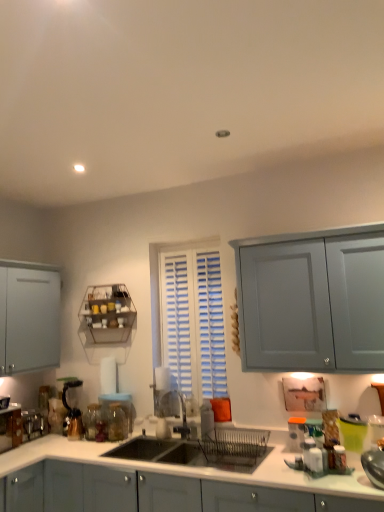
The image size is (384, 512). Describe the element at coordinates (34, 424) in the screenshot. I see `metallic silver toaster at lower left, the third appliance positioned from the front` at that location.

The image size is (384, 512). Describe the element at coordinates (117, 422) in the screenshot. I see `transparent glass jar at sink, the 1th glass jar viewed from the right` at that location.

This screenshot has width=384, height=512. What do you see at coordinates (106, 321) in the screenshot? I see `metallic wire rack at upper left` at bounding box center [106, 321].

Measure the distance between metallic wire rack at upper left and camera.

They are 3.28 meters apart.

The image size is (384, 512). Describe the element at coordinates (94, 423) in the screenshot. I see `transparent glass jar at lower left, the second glass jar viewed from the right` at that location.

Find the location of `white glossy salt shaker at lower right, the 2th appliance in the left-to-right sequence`. white glossy salt shaker at lower right, the 2th appliance in the left-to-right sequence is located at coordinates (314, 458).

At what (x,y) coordinates should I click in order to perform the action: click on metallic silver toaster at lower left, which appears as the 1th appliance when viewed from the back. Please return your answer as a coordinate pair (x, y). The height and width of the screenshot is (512, 384). Looking at the image, I should click on [x=34, y=424].

In the scene shown: From a real-world perspective, relative to metallic silver toaster at lower left, which is the 1th appliance in left-to-right order, is metallic wire rack at upper left vertically above or below?

Clearly, from a real-world perspective, metallic wire rack at upper left is above metallic silver toaster at lower left, which is the 1th appliance in left-to-right order.

Between point (127, 289) and point (30, 423), which one is positioned in front?

The point (30, 423) is more forward.

Is metallic wire rack at upper left in front of metallic silver toaster at lower left, which is the 3th appliance in right-to-left order?

No, it is not.

Is metallic wire rack at upper left inside or outside of metallic silver toaster at lower left, which is the 1th appliance in left-to-right order?

metallic wire rack at upper left is outside metallic silver toaster at lower left, which is the 1th appliance in left-to-right order.

From the image's perspective, is white glossy salt shaker at lower right, the 3th appliance when ordered from back to front, above metallic silver toaster at lower left, which appears as the 1th appliance when viewed from the back?

Indeed, from the image's perspective, white glossy salt shaker at lower right, the 3th appliance when ordered from back to front, is shown above metallic silver toaster at lower left, which appears as the 1th appliance when viewed from the back.

Does white glossy salt shaker at lower right, the 3th appliance when ordered from back to front, lie behind metallic silver toaster at lower left, which appears as the 1th appliance when viewed from the back?

No, it is in front of metallic silver toaster at lower left, which appears as the 1th appliance when viewed from the back.

How distant is white glossy salt shaker at lower right, the second appliance from the right, from metallic silver toaster at lower left, which appears as the 1th appliance when viewed from the back?

white glossy salt shaker at lower right, the second appliance from the right, and metallic silver toaster at lower left, which appears as the 1th appliance when viewed from the back, are 2.02 meters apart.

In the scene shown: Is white glossy salt shaker at lower right, the first appliance viewed from the front, positioned beyond the bounds of metallic silver toaster at lower left, which is the 1th appliance in left-to-right order?

Yes, white glossy salt shaker at lower right, the first appliance viewed from the front, is not within metallic silver toaster at lower left, which is the 1th appliance in left-to-right order.

Looking at this image, from the image's perspective, between white glossy salt shaker at lower right, the 3th appliance when ordered from back to front, and matte plastic container at right, the 2th appliance when ordered from front to back, who is located below?

From the image's view, matte plastic container at right, the 2th appliance when ordered from front to back, is below.

Is white glossy salt shaker at lower right, the second appliance from the right, aimed at matte plastic container at right, the 3th appliance positioned from the left?

No.

Is white glossy salt shaker at lower right, the first appliance viewed from the front, positioned far away from matte plastic container at right, the 2th appliance when ordered from front to back?

That's not correct — white glossy salt shaker at lower right, the first appliance viewed from the front, is a little close to matte plastic container at right, the 2th appliance when ordered from front to back.

Looking at this image, how far apart are white glossy salt shaker at lower right, the first appliance viewed from the front, and matte plastic container at right, which is the 2th appliance from back to front?

white glossy salt shaker at lower right, the first appliance viewed from the front, is 7.59 inches from matte plastic container at right, which is the 2th appliance from back to front.

From a real-world perspective, between transparent glass jar at lower left, the second glass jar viewed from the right, and metallic wire rack at upper left, who is vertically higher?

From a 3D spatial view, metallic wire rack at upper left is above.

From the image's perspective, is transparent glass jar at lower left, which appears as the first glass jar when viewed from the left, below metallic wire rack at upper left?

Yes, from the image's perspective, transparent glass jar at lower left, which appears as the first glass jar when viewed from the left, is beneath metallic wire rack at upper left.

Considering the relative sizes of transparent glass jar at lower left, which appears as the first glass jar when viewed from the left, and metallic wire rack at upper left in the image provided, is transparent glass jar at lower left, which appears as the first glass jar when viewed from the left, shorter than metallic wire rack at upper left?

Yes, transparent glass jar at lower left, which appears as the first glass jar when viewed from the left, is shorter than metallic wire rack at upper left.

Is transparent glass jar at lower left, the second glass jar viewed from the right, closer to camera compared to metallic wire rack at upper left?

Yes, transparent glass jar at lower left, the second glass jar viewed from the right, is closer to the viewer.

Would you say matte plastic container at right, the 3th appliance positioned from the left, is inside or outside transparent glass jar at sink, the 1th glass jar viewed from the right?

matte plastic container at right, the 3th appliance positioned from the left, is located beyond the bounds of transparent glass jar at sink, the 1th glass jar viewed from the right.

From the image's perspective, between matte plastic container at right, the 3th appliance positioned from the left, and transparent glass jar at sink, the second glass jar positioned from the left, who is located below?

transparent glass jar at sink, the second glass jar positioned from the left, from the image's perspective.

From a real-world perspective, is matte plastic container at right, the 3th appliance positioned from the left, physically above transparent glass jar at sink, the 1th glass jar viewed from the right?

No.

Is point (100, 404) farther from viewer compared to point (124, 422)?

Yes, it is.

Looking at this image, looking at the image, does transparent glass jar at lower left, which appears as the first glass jar when viewed from the left, seem bigger or smaller compared to transparent glass jar at sink, the second glass jar positioned from the left?

transparent glass jar at lower left, which appears as the first glass jar when viewed from the left, is bigger than transparent glass jar at sink, the second glass jar positioned from the left.

Could you tell me if transparent glass jar at lower left, the second glass jar viewed from the right, is facing transparent glass jar at sink, the second glass jar positioned from the left?

No, transparent glass jar at lower left, the second glass jar viewed from the right, is not turned towards transparent glass jar at sink, the second glass jar positioned from the left.

In order to click on glass jar above the transparent glass jar at lower left, which appears as the first glass jar when viewed from the left (from the image's perspective) in this screenshot , I will do `click(117, 422)`.

Which object is positioned more to the left, metallic silver toaster at lower left, which appears as the 1th appliance when viewed from the back, or transparent glass jar at lower left, which appears as the first glass jar when viewed from the left?

From the viewer's perspective, metallic silver toaster at lower left, which appears as the 1th appliance when viewed from the back, appears more on the left side.

Who is taller, metallic silver toaster at lower left, which is the 3th appliance in right-to-left order, or transparent glass jar at lower left, the second glass jar viewed from the right?

With more height is transparent glass jar at lower left, the second glass jar viewed from the right.

Between point (30, 424) and point (98, 410), which one is positioned in front?

Positioned in front is point (98, 410).

You are a GUI agent. You are given a task and a screenshot of the screen. Output one action in this format:
    pyautogui.click(x=<x>, y=<y>)
    Task: Click on the shelf behind the metallic silver toaster at lower left, which is the 3th appliance in right-to-left order
    
    Given the screenshot: What is the action you would take?
    pyautogui.click(x=106, y=321)

In order to click on appliance on the left of the white glossy salt shaker at lower right, the second appliance from the right in this screenshot , I will do `click(34, 424)`.

Looking at the image, which one is located closer to white glossy salt shaker at lower right, the 3th appliance when ordered from back to front, metallic wire rack at upper left or transparent glass jar at lower left, which appears as the first glass jar when viewed from the left?

transparent glass jar at lower left, which appears as the first glass jar when viewed from the left, is positioned closer to the anchor white glossy salt shaker at lower right, the 3th appliance when ordered from back to front.

From the image, which object appears to be farther from metallic silver toaster at lower left, the third appliance positioned from the front, matte gray cabinets at center or matte black coffee machine at lower left?

The object further to metallic silver toaster at lower left, the third appliance positioned from the front, is matte gray cabinets at center.

Based on their spatial positions, is matte plastic container at right, the 2th appliance when ordered from front to back, or metallic silver toaster at lower left, the third appliance positioned from the front, closer to matte black coffee machine at lower left?

Based on the image, metallic silver toaster at lower left, the third appliance positioned from the front, appears to be nearer to matte black coffee machine at lower left.

Based on their spatial positions, is matte gray cabinets at center or transparent glass jar at sink, the 1th glass jar viewed from the right, closer to transparent glass jar at lower left, which appears as the first glass jar when viewed from the left?

transparent glass jar at sink, the 1th glass jar viewed from the right, is positioned closer to the anchor transparent glass jar at lower left, which appears as the first glass jar when viewed from the left.

From the image, which object appears to be nearer to metallic wire rack at upper left, matte plastic container at right, the 2th appliance when ordered from front to back, or metallic silver toaster at lower left, which is the 1th appliance in left-to-right order?

metallic silver toaster at lower left, which is the 1th appliance in left-to-right order, is positioned closer to the anchor metallic wire rack at upper left.

From the image, which object appears to be nearer to transparent glass jar at lower left, the second glass jar viewed from the right, matte gray cabinets at center or metallic wire rack at upper left?

metallic wire rack at upper left is positioned closer to the anchor transparent glass jar at lower left, the second glass jar viewed from the right.

Based on their spatial positions, is transparent glass jar at lower left, which appears as the first glass jar when viewed from the left, or matte gray cabinets at center further from metallic wire rack at upper left?

A: matte gray cabinets at center is further to metallic wire rack at upper left.

Which object lies further to the anchor point metallic silver toaster at lower left, which is the 3th appliance in right-to-left order, white glossy salt shaker at lower right, the first appliance viewed from the front, or matte plastic container at right, positioned as the 1th appliance in right-to-left order?

white glossy salt shaker at lower right, the first appliance viewed from the front.

Find the location of a particular element. coffee machine located between metallic silver toaster at lower left, which is the 3th appliance in right-to-left order, and matte plastic container at right, the 3th appliance positioned from the left, in the left-right direction is located at coordinates (72, 414).

What are the coordinates of `coffee machine between metallic wire rack at upper left and metallic silver toaster at lower left, which is the 3th appliance in right-to-left order, in the up-down direction` in the screenshot? It's located at (72, 414).

At what (x,y) coordinates should I click in order to perform the action: click on cabinetry situated between metallic silver toaster at lower left, which is the 3th appliance in right-to-left order, and white glossy salt shaker at lower right, the second appliance from the right, from left to right. Please return your answer as a coordinate pair (x, y). Image resolution: width=384 pixels, height=512 pixels. Looking at the image, I should click on (166, 484).

Locate an element on the screen. This screenshot has height=512, width=384. coffee machine between metallic wire rack at upper left and transparent glass jar at lower left, the second glass jar viewed from the right, vertically is located at coordinates (72, 414).